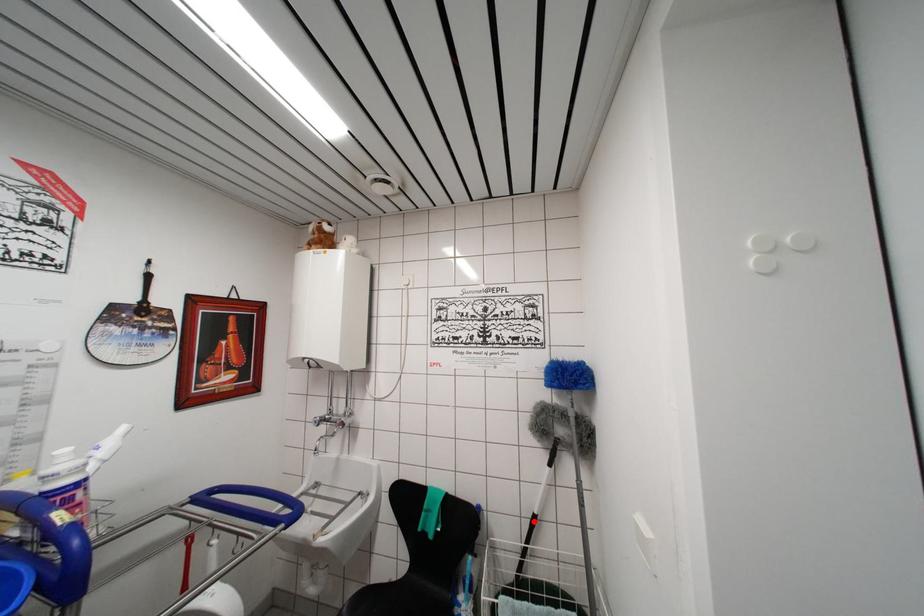
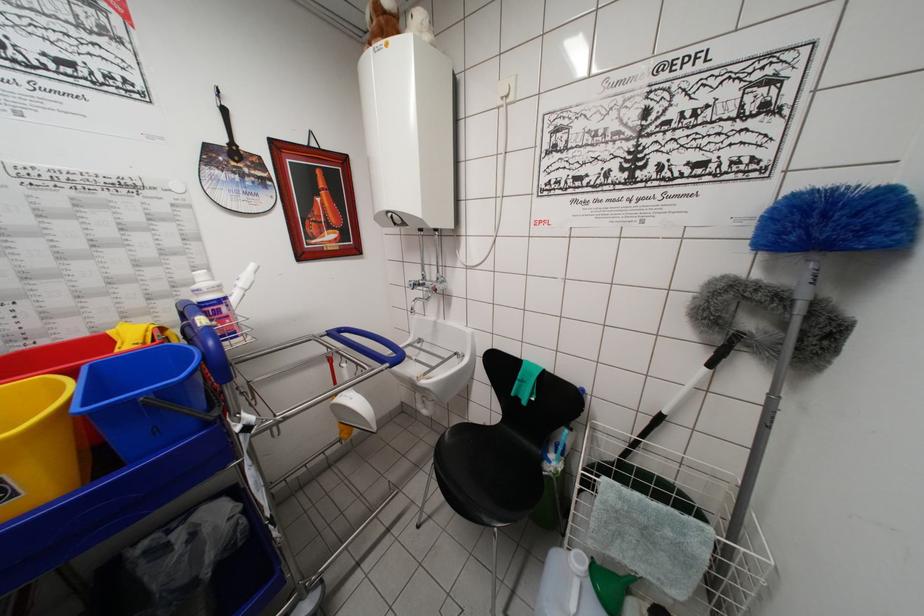
Question: A red point is marked in image1. In image2, is the corresponding 3D point closer to the camera or farther? Reply with the corresponding letter.

Choices:
 (A) The corresponding 3D point is closer.
 (B) The corresponding 3D point is farther.

Answer: (A)